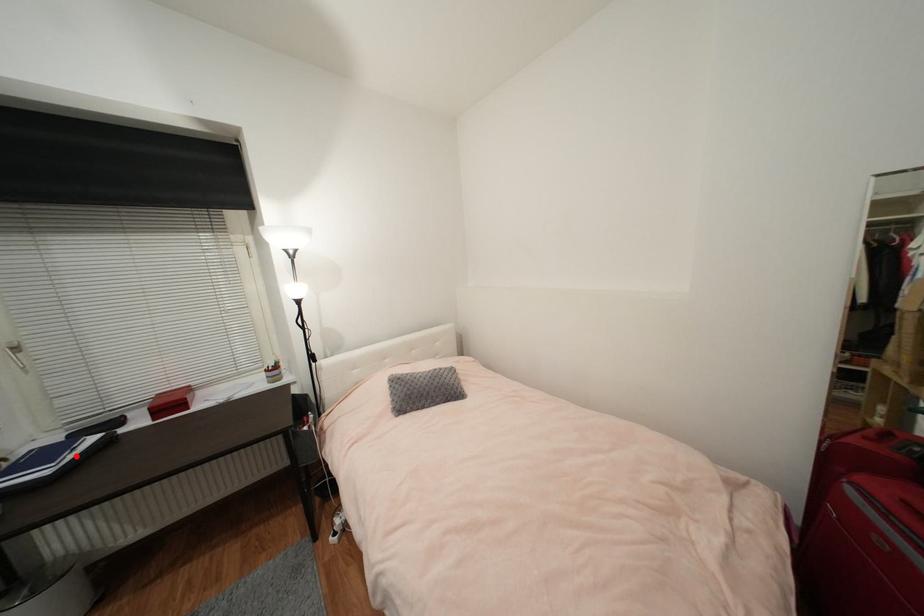
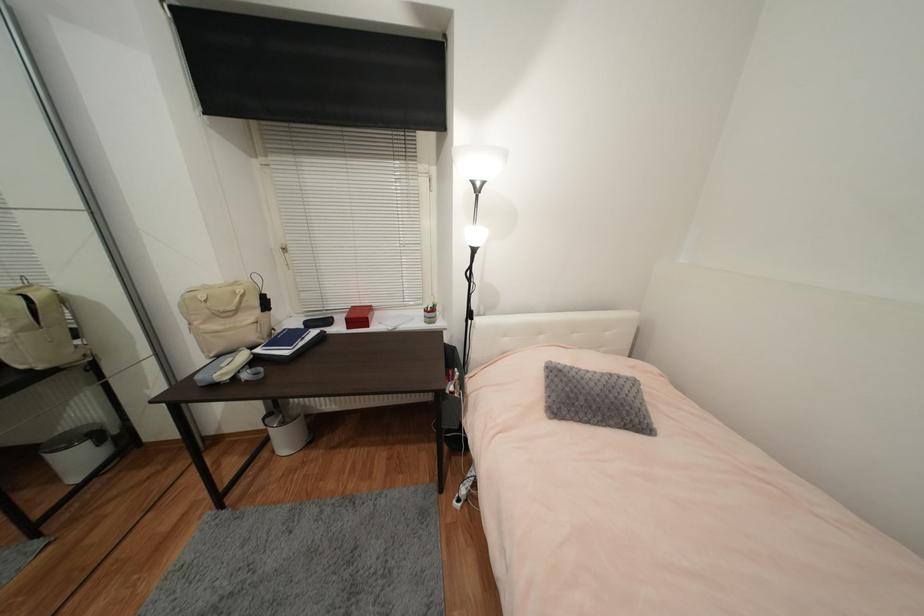
Find the pixel in the second image that matches the highlighted location in the first image.

(306, 344)